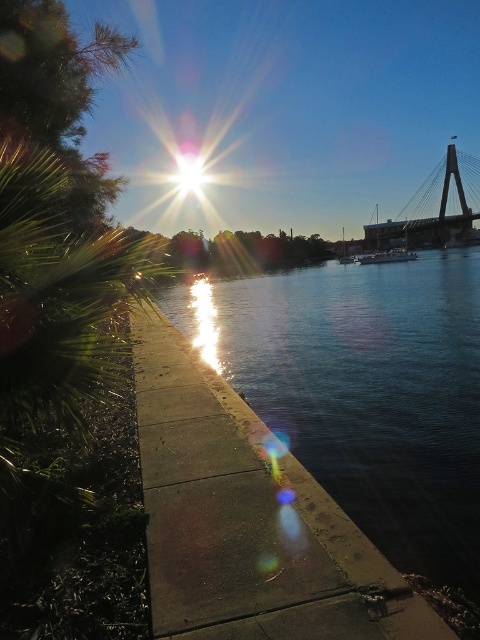
Can you confirm if concrete at center is positioned above metallic gray bridge at upper right?

Incorrect, concrete at center is not positioned above metallic gray bridge at upper right.

Between point (382, 572) and point (395, 227), which one is positioned in front?

Point (382, 572) is in front.

The width and height of the screenshot is (480, 640). What do you see at coordinates (247, 518) in the screenshot? I see `concrete at center` at bounding box center [247, 518].

The height and width of the screenshot is (640, 480). Identify the location of concrete at center. (247, 518).